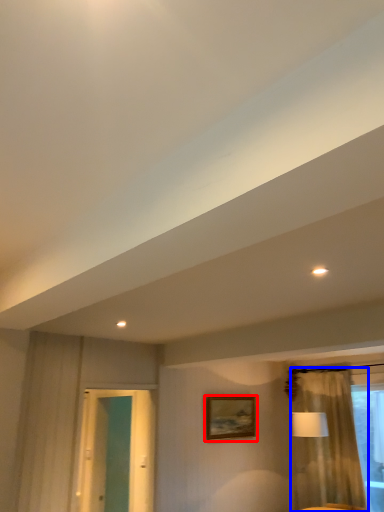
Question: Which point is further to the camera, picture frame (highlighted by a red box) or curtain (highlighted by a blue box)?

Choices:
 (A) picture frame
 (B) curtain

Answer: (A)